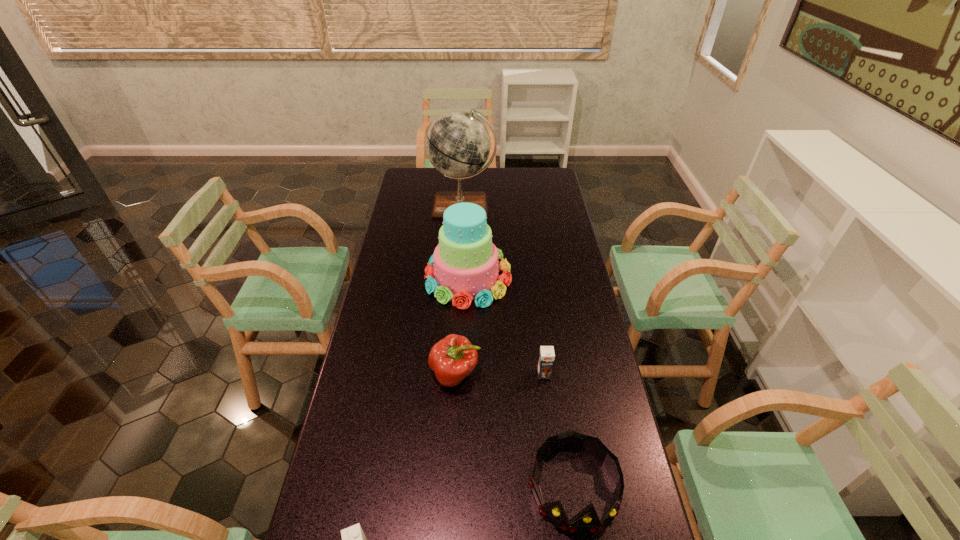
You are a GUI agent. You are given a task and a screenshot of the screen. Output one action in this format:
    pyautogui.click(x=<x>, y=<y>)
    Task: Click on the blank region between the pepper and the cake
    This screenshot has width=960, height=540.
    Given the screenshot: What is the action you would take?
    pyautogui.click(x=462, y=326)

Locate an element on the screen. The width and height of the screenshot is (960, 540). free space that is in between the farther chocolate milk and the fifth shortest object is located at coordinates (506, 326).

In order to click on the fourth closest object to the right chocolate milk in this screenshot , I will do `click(353, 538)`.

At what (x,y) coordinates should I click in order to perform the action: click on the fourth closest object to the cake. Please return your answer as a coordinate pair (x, y). The image size is (960, 540). Looking at the image, I should click on (587, 520).

Identify which chocolate milk is the nearest to the tallest object. Please provide its 2D coordinates. Your answer should be formatted as a tuple, i.e. [(x, y)], where the tuple contains the x and y coordinates of a point satisfying the conditions above.

[(546, 356)]

Identify the location of chocolate milk that stands as the closest to the second nearest object. This screenshot has height=540, width=960. (546, 356).

Where is `vacant point that satisfies the following two spatial constraints: 1. at the equator of the tallest object; 2. on the right side of the fifth shortest object`? vacant point that satisfies the following two spatial constraints: 1. at the equator of the tallest object; 2. on the right side of the fifth shortest object is located at coordinates (459, 278).